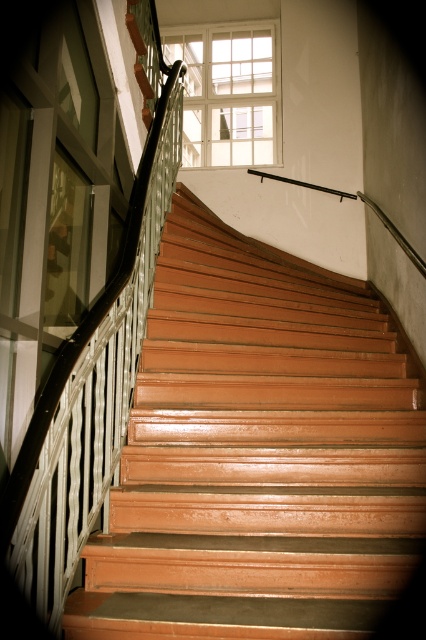
Consider the image. You are standing at the bottom of the staircase and want to know which object, the peach glossy stairs at center or the clear glass window at upper center, takes up more visual space in the image. Which one is it?

The peach glossy stairs at center takes up more visual space in the image as it is larger in size than the clear glass window at upper center.

You are standing at the bottom of the staircase and want to know if the peach glossy stairs at center are taller than the clear glass window at upper center. Can you confirm this?

The peach glossy stairs at center are taller than the clear glass window at upper center according to the description.